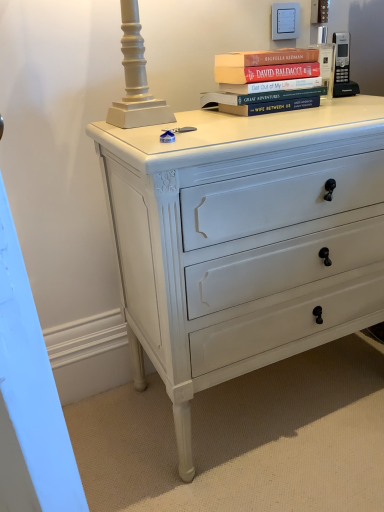
Measure the distance between point (382, 174) and camera.

Point (382, 174) is 35.55 inches from camera.

Image resolution: width=384 pixels, height=512 pixels. Describe the element at coordinates (343, 66) in the screenshot. I see `black plastic phone at upper right` at that location.

Locate an element on the screen. The image size is (384, 512). white painted wood chest of drawers at center is located at coordinates (243, 241).

Identify the location of chest of drawers on the left of black plastic phone at upper right. (243, 241).

Can you tell me how much black plastic phone at upper right and white painted wood chest of drawers at center differ in facing direction?

0.567 degrees separate the facing orientations of black plastic phone at upper right and white painted wood chest of drawers at center.

Consider the image. Is black plastic phone at upper right shorter than white painted wood chest of drawers at center?

Yes, black plastic phone at upper right is shorter than white painted wood chest of drawers at center.

Is black plastic phone at upper right to the left or to the right of white painted wood chest of drawers at center in the image?

black plastic phone at upper right is positioned on white painted wood chest of drawers at center's right side.

Between white painted wood chest of drawers at center and black plastic phone at upper right, which one has larger size?

Bigger between the two is white painted wood chest of drawers at center.

Can you see white painted wood chest of drawers at center touching black plastic phone at upper right?

No, white painted wood chest of drawers at center is not beside black plastic phone at upper right.

From a real-world perspective, which is physically above, white painted wood chest of drawers at center or black plastic phone at upper right?

In real-world perspective, black plastic phone at upper right is above.

Can we say white painted wood chest of drawers at center lies outside black plastic phone at upper right?

Indeed, white painted wood chest of drawers at center is completely outside black plastic phone at upper right.

Is hardcover books at upper center oriented away from black plastic phone at upper right?

hardcover books at upper center is not turned away from black plastic phone at upper right.

Which object is closer to the camera, hardcover books at upper center or black plastic phone at upper right?

Positioned in front is hardcover books at upper center.

From the picture: Is hardcover books at upper center bigger than black plastic phone at upper right?

Yes, hardcover books at upper center is bigger than black plastic phone at upper right.

From the image's perspective, is hardcover books at upper center located above or below black plastic phone at upper right?

hardcover books at upper center is below black plastic phone at upper right.

Is hardcover books at upper center located within black plastic phone at upper right?

Actually, hardcover books at upper center is outside black plastic phone at upper right.

Which object is positioned more to the right, black plastic phone at upper right or hardcover books at upper center?

black plastic phone at upper right.

Does black plastic phone at upper right have a smaller size compared to hardcover books at upper center?

Yes, black plastic phone at upper right is smaller than hardcover books at upper center.

Is white painted wood chest of drawers at center to the left or to the right of hardcover books at upper center in the image?

Based on their positions, white painted wood chest of drawers at center is located to the right of hardcover books at upper center.

Is white painted wood chest of drawers at center facing away from hardcover books at upper center?

white painted wood chest of drawers at center is not turned away from hardcover books at upper center.

Is white painted wood chest of drawers at center next to hardcover books at upper center and touching it?

No, white painted wood chest of drawers at center is not beside hardcover books at upper center.

Is white painted wood chest of drawers at center smaller than hardcover books at upper center?

No.

Which object is thinner, hardcover books at upper center or white painted wood chest of drawers at center?

hardcover books at upper center.

Considering the points (285, 86) and (354, 324), which point is behind, point (285, 86) or point (354, 324)?

Positioned behind is point (354, 324).

Is hardcover books at upper center shorter than white painted wood chest of drawers at center?

Correct, hardcover books at upper center is not as tall as white painted wood chest of drawers at center.

In the image, there is a black plastic phone at upper right. Where is `the chest of drawers below it (from a real-world perspective)`? The image size is (384, 512). the chest of drawers below it (from a real-world perspective) is located at coordinates (243, 241).

The width and height of the screenshot is (384, 512). In order to click on gadget lying above the white painted wood chest of drawers at center (from the image's perspective) in this screenshot , I will do `click(343, 66)`.

Looking at the image, which one is located closer to hardcover books at upper center, black plastic phone at upper right or white painted wood chest of drawers at center?

The object closer to hardcover books at upper center is black plastic phone at upper right.

Estimate the real-world distances between objects in this image. Which object is closer to hardcover books at upper center, white painted wood chest of drawers at center or black plastic phone at upper right?

black plastic phone at upper right.

Based on their spatial positions, is white painted wood chest of drawers at center or hardcover books at upper center closer to black plastic phone at upper right?

hardcover books at upper center is positioned closer to the anchor black plastic phone at upper right.

Which object lies nearer to the anchor point black plastic phone at upper right, hardcover books at upper center or white painted wood chest of drawers at center?

hardcover books at upper center.

Based on their spatial positions, is hardcover books at upper center or black plastic phone at upper right closer to white painted wood chest of drawers at center?

hardcover books at upper center lies closer to white painted wood chest of drawers at center than the other object.

From the image, which object appears to be nearer to white painted wood chest of drawers at center, black plastic phone at upper right or hardcover books at upper center?

The object closer to white painted wood chest of drawers at center is hardcover books at upper center.

This screenshot has height=512, width=384. I want to click on book that lies between black plastic phone at upper right and white painted wood chest of drawers at center from top to bottom, so click(264, 77).